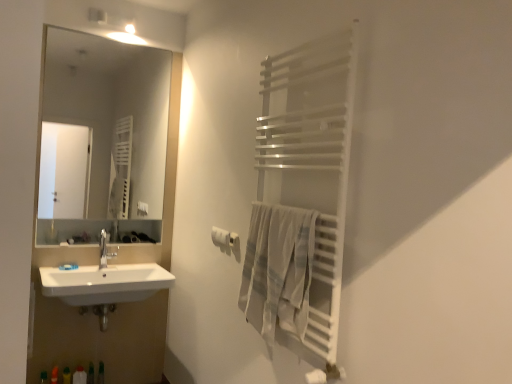
Question: Is white plastic bottle at lower left, which ranks as the second toiletry in right-to-left order, facing away from light gray woven towel at right?

Choices:
 (A) yes
 (B) no

Answer: (B)

Question: Would you say light gray woven towel at right is part of white plastic bottle at lower left, which ranks as the second toiletry in right-to-left order,'s contents?

Choices:
 (A) yes
 (B) no

Answer: (B)

Question: Does white plastic bottle at lower left, which ranks as the second toiletry in right-to-left order, have a greater height compared to light gray woven towel at right?

Choices:
 (A) no
 (B) yes

Answer: (A)

Question: From a real-world perspective, is white plastic bottle at lower left, which appears as the first toiletry when viewed from the left, physically below light gray woven towel at right?

Choices:
 (A) yes
 (B) no

Answer: (A)

Question: Is white plastic bottle at lower left, which ranks as the second toiletry in right-to-left order, smaller than light gray woven towel at right?

Choices:
 (A) yes
 (B) no

Answer: (A)

Question: From the image's perspective, is white plastic bottle at lower left, which ranks as the second toiletry in right-to-left order, below light gray woven towel at right?

Choices:
 (A) yes
 (B) no

Answer: (A)

Question: From a real-world perspective, is translucent plastic bottle at lower left, placed as the 2th toiletry when sorted from left to right, physically above white plastic bottle at lower left, which ranks as the second toiletry in right-to-left order?

Choices:
 (A) yes
 (B) no

Answer: (A)

Question: Does translucent plastic bottle at lower left, placed as the 2th toiletry when sorted from left to right, touch white plastic bottle at lower left, which appears as the first toiletry when viewed from the left?

Choices:
 (A) no
 (B) yes

Answer: (A)

Question: Is the position of translucent plastic bottle at lower left, which is the 1th toiletry in right-to-left order, less distant than that of white plastic bottle at lower left, which appears as the first toiletry when viewed from the left?

Choices:
 (A) no
 (B) yes

Answer: (A)

Question: Would you say white plastic bottle at lower left, which appears as the first toiletry when viewed from the left, is part of translucent plastic bottle at lower left, placed as the 2th toiletry when sorted from left to right,'s contents?

Choices:
 (A) no
 (B) yes

Answer: (A)

Question: Is translucent plastic bottle at lower left, which is the 1th toiletry in right-to-left order, to the left of white plastic bottle at lower left, which ranks as the second toiletry in right-to-left order, from the viewer's perspective?

Choices:
 (A) no
 (B) yes

Answer: (A)

Question: Can you confirm if translucent plastic bottle at lower left, which is the 1th toiletry in right-to-left order, is wider than white plastic bottle at lower left, which appears as the first toiletry when viewed from the left?

Choices:
 (A) no
 (B) yes

Answer: (B)

Question: Is the position of light gray woven towel at right more distant than that of white plastic bottle at lower left, which ranks as the second toiletry in right-to-left order?

Choices:
 (A) yes
 (B) no

Answer: (B)